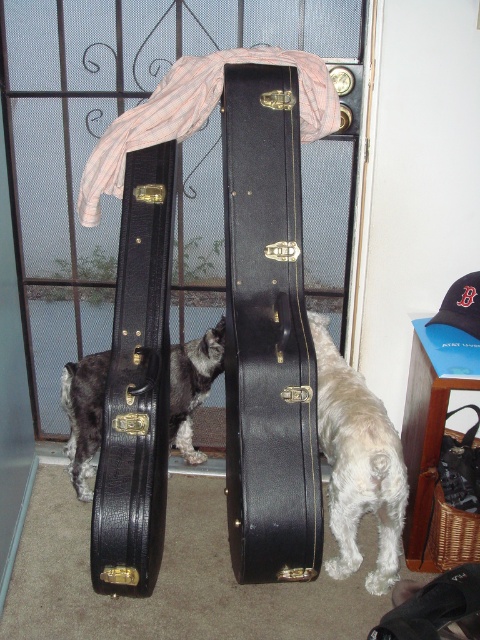
You are standing at point [280,536] in the image. There are two black guitar cases. Can you reach both cases from this position without moving your feet? Explain your answer using their distance apart.

The two black guitar cases are 4.74 feet apart. Since the distance between them is more than an average person can reach with both arms extended, you cannot reach both cases from the same position without moving your feet.

You are a delivery person who needs to place a new guitar case between the black leather guitar case at left and the white fluffy dog at lower right. Based on their current positions, can you fit the new guitar case there without moving either of them?

The black leather guitar case at left is located above the white fluffy dog at lower right, so there is space between them where you can place the new guitar case.

You are a delivery person who needs to place a small package between the black leather guitar case at center and the black leather guitar case at left. Is there enough vertical space between them to fit the package?

The black leather guitar case at center is located above the black leather guitar case at left, so there is vertical space between them. The package can be placed in the vertical gap between the black leather guitar case at center and the black leather guitar case at left.